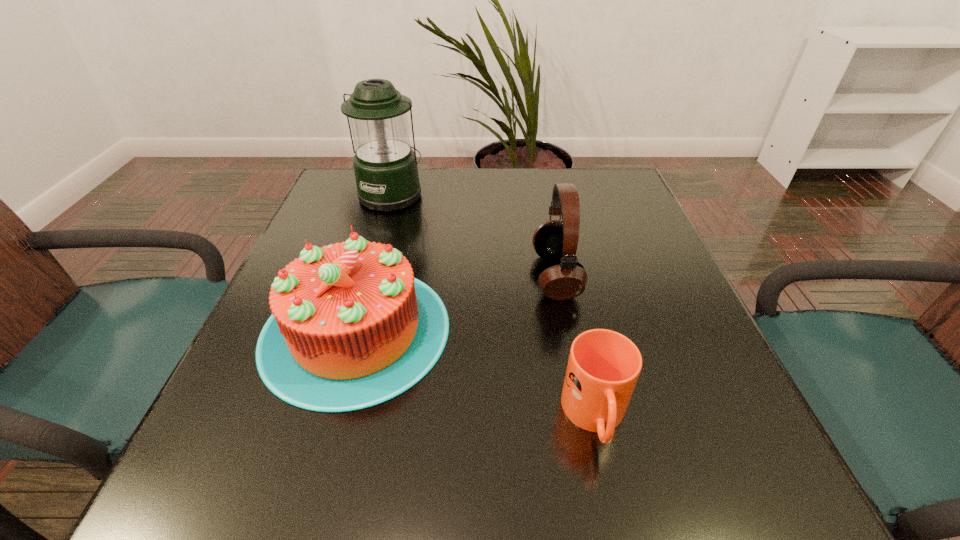
At what (x,y) coordinates should I click in order to perform the action: click on object that is at the far edge. Please return your answer as a coordinate pair (x, y). Looking at the image, I should click on (385, 166).

Find the location of a particular element. object that is positioned at the near edge is located at coordinates (603, 367).

The image size is (960, 540). What are the coordinates of `lantern that is at the left edge` in the screenshot? It's located at (385, 166).

I want to click on cake that is at the left edge, so click(351, 328).

The image size is (960, 540). In order to click on object at the far left corner in this screenshot , I will do `click(385, 166)`.

Find the location of a particular element. This screenshot has width=960, height=540. vacant space at the far edge is located at coordinates (474, 178).

I want to click on vacant space at the near edge of the desktop, so click(x=492, y=491).

In the image, there is a desktop. Where is `free space at the left edge`? free space at the left edge is located at coordinates (304, 235).

I want to click on vacant space at the right edge of the desktop, so click(605, 280).

Locate an element on the screen. The width and height of the screenshot is (960, 540). blank space at the near left corner of the desktop is located at coordinates (269, 505).